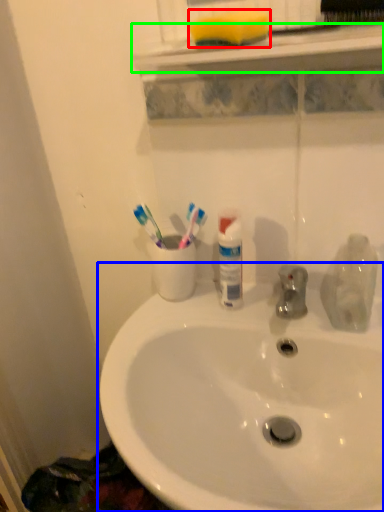
Question: Estimate the real-world distances between objects in this image. Which object is closer to soap (highlighted by a red box), sink (highlighted by a blue box) or window sill (highlighted by a green box)?

Choices:
 (A) sink
 (B) window sill

Answer: (B)